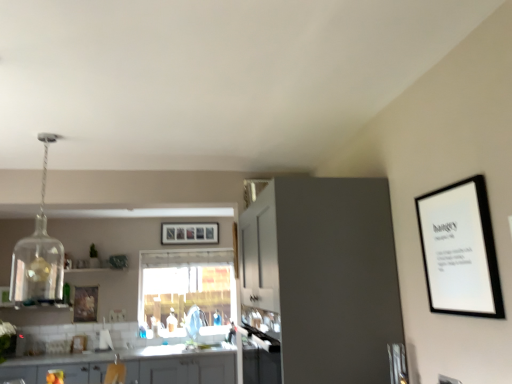
Question: Is matte gray cabinets at lower left, marked as the 1th cabinetry in a bottom-to-top arrangement, thinner than transparent glass window at center?

Choices:
 (A) no
 (B) yes

Answer: (A)

Question: Is matte gray cabinets at lower left, the 2th cabinetry viewed from the right, not close to transparent glass window at center?

Choices:
 (A) no
 (B) yes

Answer: (B)

Question: Is matte gray cabinets at lower left, which ranks as the first cabinetry in left-to-right order, at the right side of transparent glass window at center?

Choices:
 (A) no
 (B) yes

Answer: (A)

Question: Is the depth of matte gray cabinets at lower left, the 2th cabinetry positioned from the front, greater than that of transparent glass window at center?

Choices:
 (A) no
 (B) yes

Answer: (A)

Question: Does matte gray cabinets at lower left, the 2th cabinetry positioned from the front, have a greater width compared to transparent glass window at center?

Choices:
 (A) yes
 (B) no

Answer: (A)

Question: Is matte gray cabinet at center, which is the second cabinetry in back-to-front order, in front of or behind clear glass pendant at upper left in the image?

Choices:
 (A) behind
 (B) front

Answer: (B)

Question: From their relative heights in the image, would you say matte gray cabinet at center, which is the first cabinetry from top to bottom, is taller or shorter than clear glass pendant at upper left?

Choices:
 (A) short
 (B) tall

Answer: (B)

Question: In terms of size, does matte gray cabinet at center, placed as the 1th cabinetry when sorted from front to back, appear bigger or smaller than clear glass pendant at upper left?

Choices:
 (A) small
 (B) big

Answer: (B)

Question: From a real-world perspective, is matte gray cabinet at center, which is the first cabinetry from top to bottom, above or below clear glass pendant at upper left?

Choices:
 (A) below
 (B) above

Answer: (A)

Question: Looking at the image, does matte gray cabinets at lower left, the 2th cabinetry positioned from the front, seem bigger or smaller compared to transparent glass window at center?

Choices:
 (A) big
 (B) small

Answer: (A)

Question: Considering the positions of matte gray cabinets at lower left, the 2th cabinetry when ordered from top to bottom, and transparent glass window at center in the image, is matte gray cabinets at lower left, the 2th cabinetry when ordered from top to bottom, taller or shorter than transparent glass window at center?

Choices:
 (A) short
 (B) tall

Answer: (A)

Question: Is point coord(189,374) closer or farther from the camera than point coord(197,296)?

Choices:
 (A) closer
 (B) farther

Answer: (A)

Question: From a real-world perspective, is matte gray cabinets at lower left, marked as the 1th cabinetry in a bottom-to-top arrangement, positioned above or below transparent glass window at center?

Choices:
 (A) above
 (B) below

Answer: (B)

Question: In terms of height, does matte gray cabinets at lower left, the 2th cabinetry viewed from the right, look taller or shorter compared to matte yellow drawer at lower left?

Choices:
 (A) tall
 (B) short

Answer: (A)

Question: Considering their positions, is matte gray cabinets at lower left, marked as the 1th cabinetry in a bottom-to-top arrangement, located in front of or behind matte yellow drawer at lower left?

Choices:
 (A) front
 (B) behind

Answer: (B)